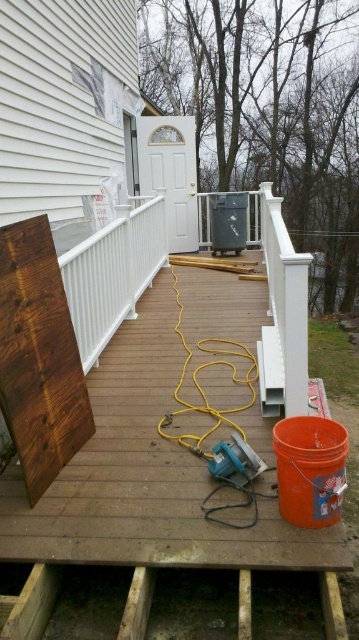
Who is positioned more to the right, brown wood board at left or white matte rail at center?

brown wood board at left

Is brown wood board at left to the left of white matte rail at center from the viewer's perspective?

Incorrect, brown wood board at left is not on the left side of white matte rail at center.

Which is behind, point (266, 298) or point (129, 205)?

Positioned behind is point (129, 205).

In order to click on brown wood board at left in this screenshot , I will do `click(150, 492)`.